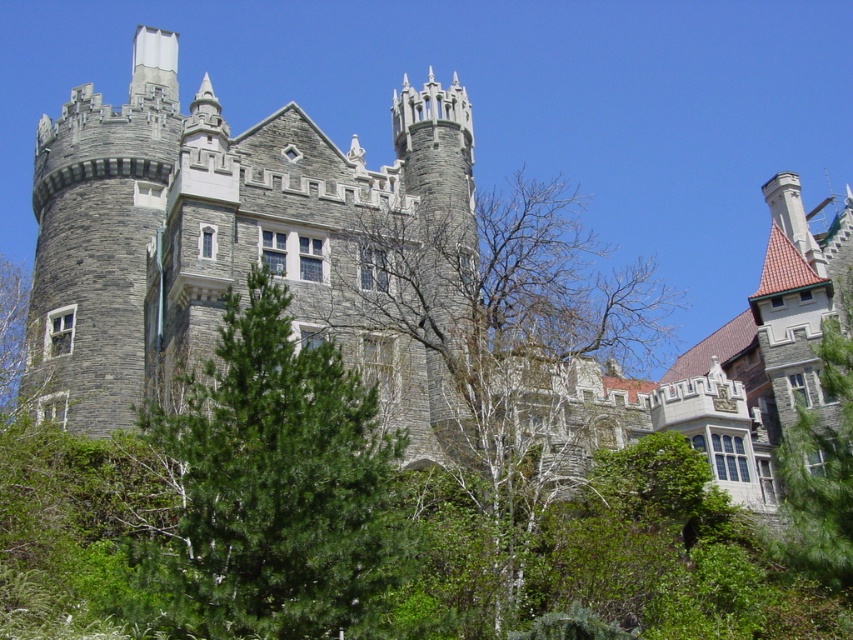
You are an architect planning to build a new structure that must fit between the gray stone tower at center and the bare branches at center. Based on their widths, which one requires more space horizontally?

The bare branches at center are wider than the gray stone tower at center, so they require more horizontal space.